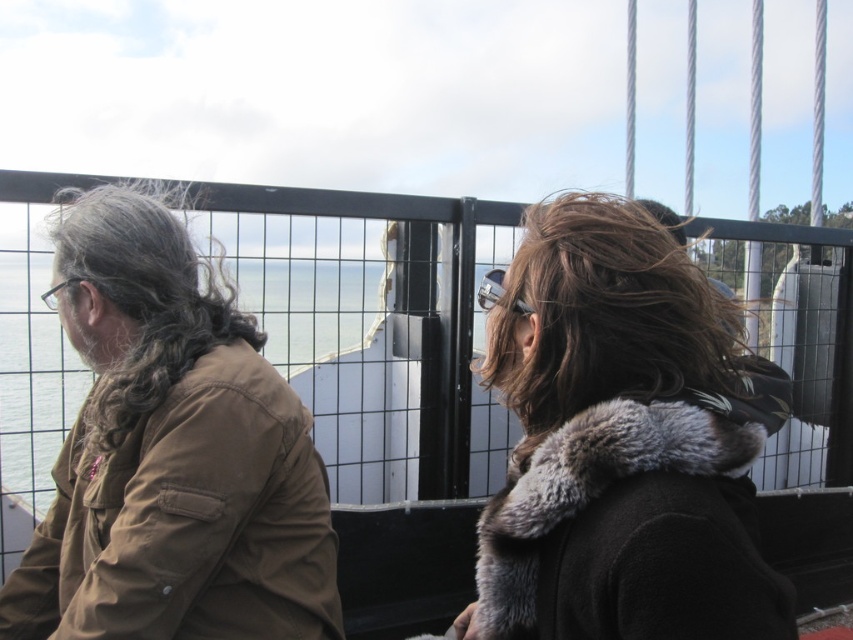
Does black metal fence at upper center have a greater height compared to gray curly hair at left?

Indeed, black metal fence at upper center has a greater height compared to gray curly hair at left.

Between black metal fence at upper center and gray curly hair at left, which one appears on the left side from the viewer's perspective?

gray curly hair at left

Between point (502, 234) and point (172, 234), which one is positioned behind?

The point (502, 234) is more distant.

Image resolution: width=853 pixels, height=640 pixels. I want to click on black metal fence at upper center, so click(x=380, y=376).

Is dark brown fur coat at center to the right of brown fuzzy hair at center from the viewer's perspective?

In fact, dark brown fur coat at center is to the left of brown fuzzy hair at center.

Is point (566, 244) behind point (569, 369)?

Yes, it is.

Where is `dark brown fur coat at center`? Image resolution: width=853 pixels, height=640 pixels. dark brown fur coat at center is located at coordinates (624, 444).

This screenshot has width=853, height=640. In order to click on dark brown fur coat at center in this screenshot , I will do coord(624,444).

Can you confirm if brown matte jacket at left is positioned above brown fuzzy hair at center?

Incorrect, brown matte jacket at left is not positioned above brown fuzzy hair at center.

Which is in front, point (202, 621) or point (706, 304)?

Point (706, 304) is in front.

Locate an element on the screen. brown matte jacket at left is located at coordinates (171, 456).

Where is `brown matte jacket at left`? This screenshot has width=853, height=640. brown matte jacket at left is located at coordinates (171, 456).